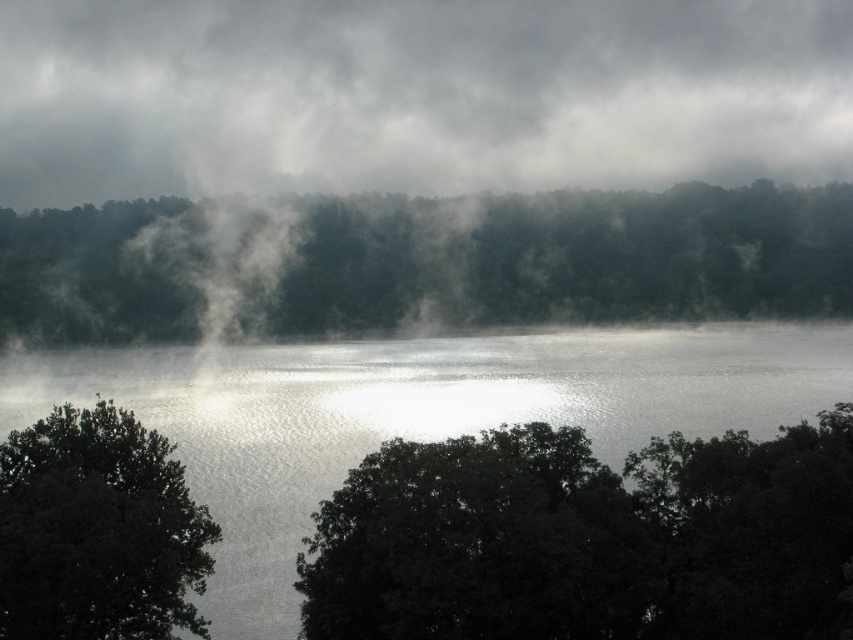
Measure the distance between green matte tree at center and dark green leafy tree at lower left.

green matte tree at center and dark green leafy tree at lower left are 104.16 meters apart from each other.

Who is more forward, (123, 253) or (77, 547)?

Point (77, 547)

Locate an element on the screen. The width and height of the screenshot is (853, 640). green matte tree at center is located at coordinates (567, 259).

At what (x,y) coordinates should I click in order to perform the action: click on dark green leafy tree at lower center. Please return your answer as a coordinate pair (x, y). The width and height of the screenshot is (853, 640). Looking at the image, I should click on (589, 540).

Is dark green leafy tree at lower center positioned in front of glistening water at center?

Answer: Yes, dark green leafy tree at lower center is in front of glistening water at center.

Who is more forward, [451,552] or [636,438]?

Point [451,552] is in front.

This screenshot has width=853, height=640. Identify the location of dark green leafy tree at lower center. (589, 540).

Between point (699, 54) and point (761, 189), which one is positioned behind?

The point (699, 54) is behind.

Does gray fog at upper center have a larger size compared to green matte tree at center?

Correct, gray fog at upper center is larger in size than green matte tree at center.

Is point (550, 72) closer to viewer compared to point (419, 202)?

No, it is behind (419, 202).

Where is `gray fog at upper center`? The width and height of the screenshot is (853, 640). gray fog at upper center is located at coordinates (416, 96).